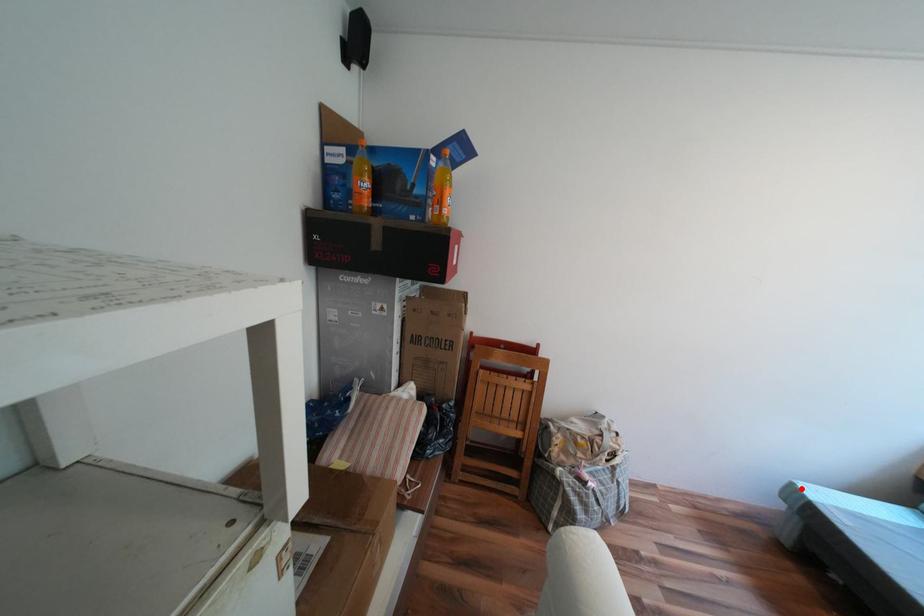
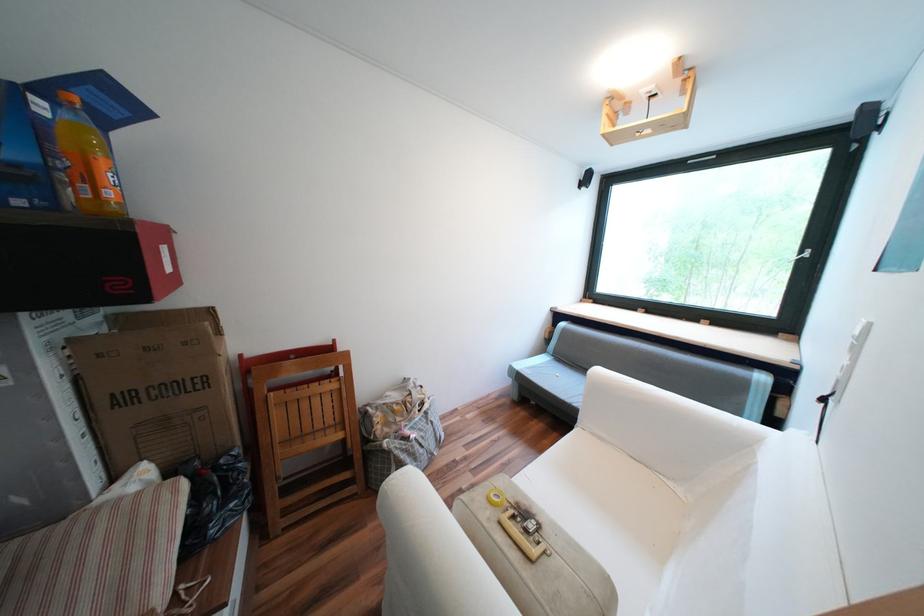
Where in the second image is the point corresponding to the highlighted location from the first image?

(520, 369)